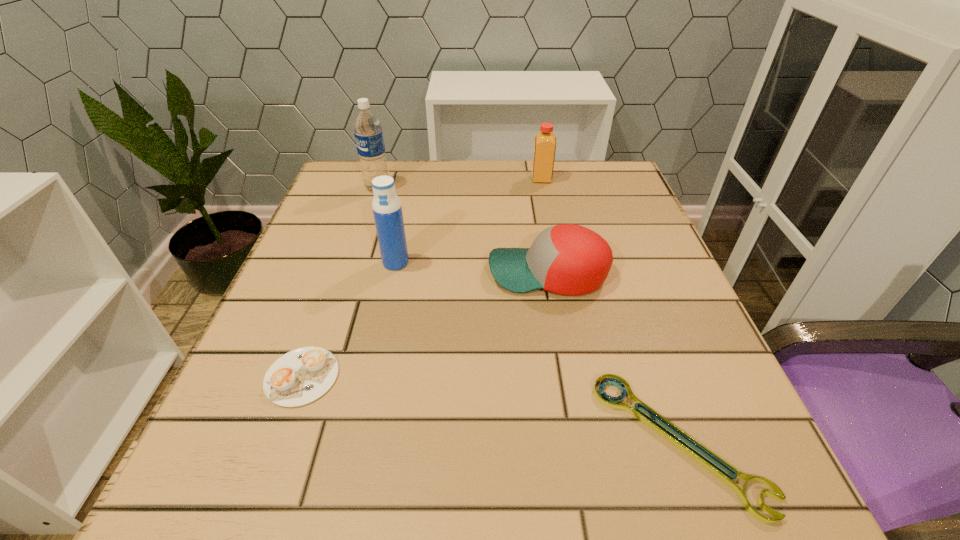
Where is `vacant space located on the front and back of the fourth shortest object`? The height and width of the screenshot is (540, 960). vacant space located on the front and back of the fourth shortest object is located at coordinates (468, 179).

At what (x,y) coordinates should I click in order to perform the action: click on vacant space situated on the front and back of the fourth shortest object. Please return your answer as a coordinate pair (x, y). Looking at the image, I should click on (508, 179).

Find the location of a particular element. The height and width of the screenshot is (540, 960). vacant space located 0.150m at the brim of the fourth tallest object is located at coordinates (411, 273).

Locate an element on the screen. vacant space positioned at the brim of the fourth tallest object is located at coordinates (400, 273).

The width and height of the screenshot is (960, 540). In order to click on vacant region located at the brim of the fourth tallest object in this screenshot , I will do `click(421, 273)`.

Locate an element on the screen. vacant space located 0.130m on the right of the cappuccino is located at coordinates (422, 376).

Where is `vacant space located on the back of the shortest object`? vacant space located on the back of the shortest object is located at coordinates (605, 231).

You are a GUI agent. You are given a task and a screenshot of the screen. Output one action in this format:
    pyautogui.click(x=<x>, y=<y>)
    Task: Click on the water bottle at the far edge
    The image size is (960, 540).
    Given the screenshot: What is the action you would take?
    pyautogui.click(x=367, y=128)

I want to click on orange juice located at the far edge, so click(x=545, y=141).

The height and width of the screenshot is (540, 960). I want to click on object that is positioned at the near edge, so click(606, 400).